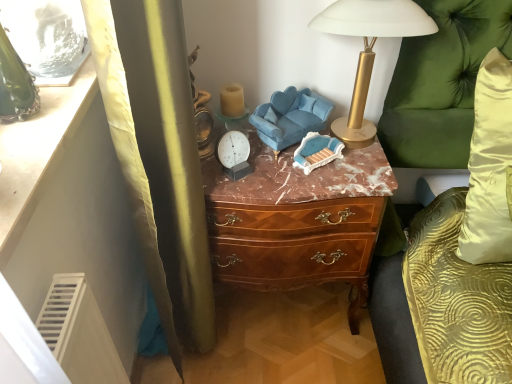
Where is `free space above brown wood chest of drawers at center (from a real-world perspective)`? This screenshot has height=384, width=512. free space above brown wood chest of drawers at center (from a real-world perspective) is located at coordinates (302, 171).